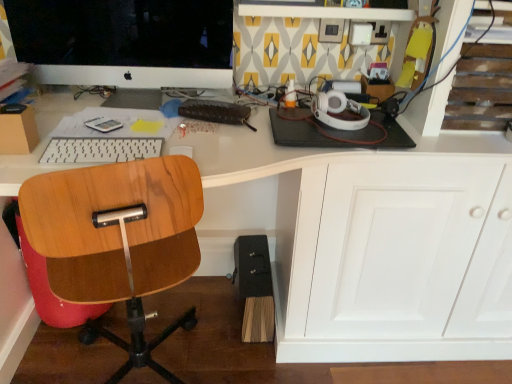
In order to click on white glossy desk at center in this screenshot , I will do `click(324, 236)`.

In the scene shown: Does wooden chair at left turn towards matte black monitor at upper left?

Yes, wooden chair at left is facing matte black monitor at upper left.

Is wooden chair at left positioned beyond the bounds of matte black monitor at upper left?

Yes, wooden chair at left is outside of matte black monitor at upper left.

Considering their positions, is wooden chair at left located in front of or behind matte black monitor at upper left?

wooden chair at left is in front of matte black monitor at upper left.

Considering the relative sizes of wooden chair at left and matte black monitor at upper left in the image provided, is wooden chair at left shorter than matte black monitor at upper left?

Incorrect, the height of wooden chair at left does not fall short of that of matte black monitor at upper left.

Visually, is white plastic keyboard at center positioned to the left or to the right of white glossy desk at center?

In the image, white plastic keyboard at center appears on the left side of white glossy desk at center.

In the scene shown: Are white plastic keyboard at center and white glossy desk at center making contact?

No.

How many degrees apart are the facing directions of white plastic keyboard at center and white glossy desk at center?

3.31 degrees separate the facing orientations of white plastic keyboard at center and white glossy desk at center.

Which object is closer to the camera, white plastic keyboard at center or white glossy desk at center?

white glossy desk at center is closer to the camera.

Can you confirm if white glossy desk at center is smaller than wooden chair at left?

Incorrect, white glossy desk at center is not smaller in size than wooden chair at left.

Image resolution: width=512 pixels, height=384 pixels. In order to click on desk above the wooden chair at left (from the image's perspective) in this screenshot , I will do `click(324, 236)`.

From the image's perspective, would you say white glossy desk at center is shown under wooden chair at left?

Actually, white glossy desk at center appears above wooden chair at left in the image.

Which of these two, matte black monitor at upper left or wooden chair at left, is bigger?

Bigger between the two is wooden chair at left.

Can you confirm if matte black monitor at upper left is positioned to the right of wooden chair at left?

No, matte black monitor at upper left is not to the right of wooden chair at left.

Is point (159, 25) farther from camera compared to point (20, 188)?

Yes, point (159, 25) is farther from viewer.

Is matte black monitor at upper left shorter than wooden chair at left?

Yes, matte black monitor at upper left is shorter than wooden chair at left.

Between white plastic keyboard at center and matte black monitor at upper left, which one appears on the left side from the viewer's perspective?

matte black monitor at upper left.

From the image's perspective, is white plastic keyboard at center located above or below matte black monitor at upper left?

Clearly, from the image's perspective, white plastic keyboard at center is below matte black monitor at upper left.

Considering the points (149, 141) and (167, 27), which point is in front, point (149, 141) or point (167, 27)?

The point (149, 141) is closer to the camera.

Which of these two, white glossy desk at center or matte black monitor at upper left, stands taller?

With more height is white glossy desk at center.

In the scene shown: Is white glossy desk at center aimed at matte black monitor at upper left?

Yes, white glossy desk at center is turned towards matte black monitor at upper left.

Is white glossy desk at center to the left or to the right of matte black monitor at upper left in the image?

Clearly, white glossy desk at center is on the right of matte black monitor at upper left in the image.

From the image's perspective, between white glossy desk at center and matte black monitor at upper left, who is located below?

From the image's view, white glossy desk at center is below.

From the image's perspective, is wooden chair at left located above or below white glossy desk at center?

From the image's perspective, wooden chair at left appears below white glossy desk at center.

Is point (52, 256) positioned in front of point (401, 320)?

Yes, it is in front of point (401, 320).

From a real-world perspective, relative to white glossy desk at center, is wooden chair at left vertically above or below?

Clearly, from a real-world perspective, wooden chair at left is below white glossy desk at center.

Is wooden chair at left to the right of white glossy desk at center from the viewer's perspective?

In fact, wooden chair at left is to the left of white glossy desk at center.

You are a GUI agent. You are given a task and a screenshot of the screen. Output one action in this format:
    pyautogui.click(x=<x>, y=<y>)
    Task: Click on the chair that appears below the matte black monitor at upper left (from a real-world perspective)
    The height and width of the screenshot is (384, 512).
    Given the screenshot: What is the action you would take?
    [118, 241]

Where is `keyboard behind the white glossy desk at center`? This screenshot has height=384, width=512. keyboard behind the white glossy desk at center is located at coordinates (100, 150).

Based on their spatial positions, is matte black monitor at upper left or white plastic keyboard at center further from white glossy desk at center?

The object further to white glossy desk at center is white plastic keyboard at center.

Which object lies further to the anchor point white plastic keyboard at center, wooden chair at left or white glossy desk at center?

white glossy desk at center is positioned further to the anchor white plastic keyboard at center.

When comparing their distances from white glossy desk at center, does white plastic keyboard at center or wooden chair at left seem further?

Among the two, white plastic keyboard at center is located further to white glossy desk at center.

From the image, which object appears to be farther from white plastic keyboard at center, white glossy desk at center or wooden chair at left?

The object further to white plastic keyboard at center is white glossy desk at center.

Looking at the image, which one is located further to white glossy desk at center, white plastic keyboard at center or matte black monitor at upper left?

white plastic keyboard at center.

Considering their positions, is wooden chair at left positioned further to white glossy desk at center than white plastic keyboard at center?

white plastic keyboard at center.

Considering their positions, is white glossy desk at center positioned further to wooden chair at left than white plastic keyboard at center?

white glossy desk at center.

Based on their spatial positions, is matte black monitor at upper left or wooden chair at left further from white plastic keyboard at center?

matte black monitor at upper left.

This screenshot has height=384, width=512. Find the location of `desk that lies between matte black monitor at upper left and wooden chair at left from top to bottom`. desk that lies between matte black monitor at upper left and wooden chair at left from top to bottom is located at coordinates (324, 236).

Locate an element on the screen. keyboard that lies between matte black monitor at upper left and wooden chair at left from top to bottom is located at coordinates (100, 150).

Identify the location of keyboard between matte black monitor at upper left and white glossy desk at center in the horizontal direction. (100, 150).

Locate an element on the screen. The width and height of the screenshot is (512, 384). chair between white plastic keyboard at center and white glossy desk at center is located at coordinates (118, 241).